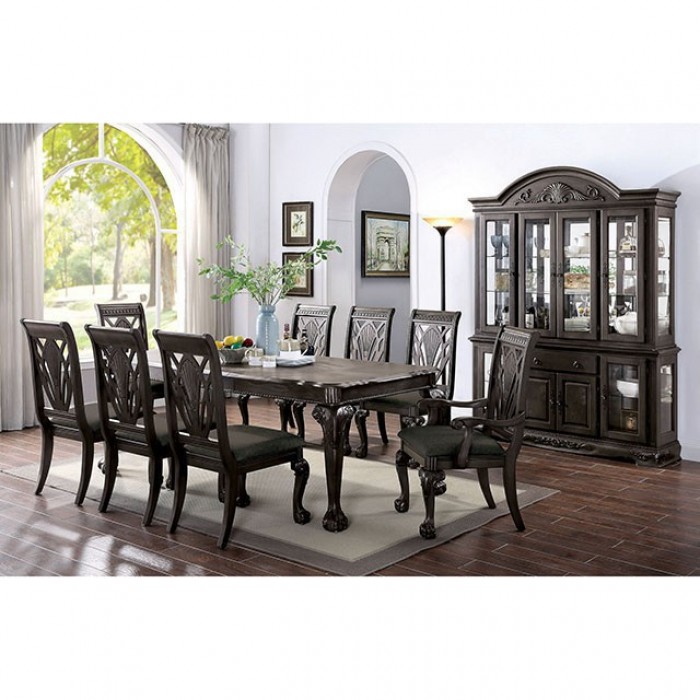
Find the location of a particular element. The height and width of the screenshot is (700, 700). chair seats is located at coordinates (469, 444), (160, 426), (92, 410), (155, 384), (399, 400).